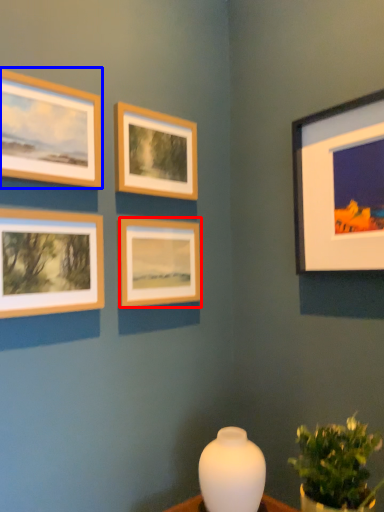
Question: Which object appears farthest to the camera in this image, picture frame (highlighted by a red box) or picture frame (highlighted by a blue box)?

Choices:
 (A) picture frame
 (B) picture frame

Answer: (A)